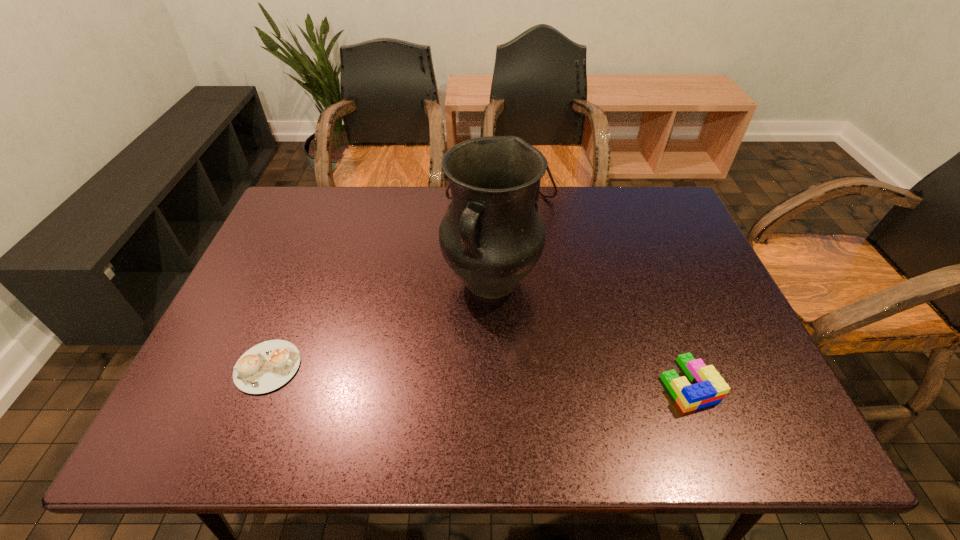
In order to click on vacant space located 0.100m on the front flap of the shoulder bag in this screenshot , I will do `click(507, 227)`.

I want to click on vacant space located 0.370m on the front flap of the shoulder bag, so click(x=516, y=293).

Locate an element on the screen. The height and width of the screenshot is (540, 960). free point located on the front flap of the shoulder bag is located at coordinates 513,269.

The height and width of the screenshot is (540, 960). Find the location of `free space located 0.140m on the handle side of the pitcher`. free space located 0.140m on the handle side of the pitcher is located at coordinates (446, 361).

Identify the location of vacant space located on the handle side of the pitcher. The image size is (960, 540). (427, 395).

Find the location of `free space located 0.070m on the handle side of the pitcher`. free space located 0.070m on the handle side of the pitcher is located at coordinates (459, 339).

Find the location of a particular element. This screenshot has width=960, height=540. object that is at the far edge is located at coordinates (539, 191).

Locate an element on the screen. This screenshot has height=540, width=960. cappuccino present at the near edge is located at coordinates (266, 366).

Image resolution: width=960 pixels, height=540 pixels. Identify the location of Lego present at the near edge. (708, 388).

At what (x,y) coordinates should I click in order to perform the action: click on object present at the left edge. Please return your answer as a coordinate pair (x, y). Looking at the image, I should click on (266, 366).